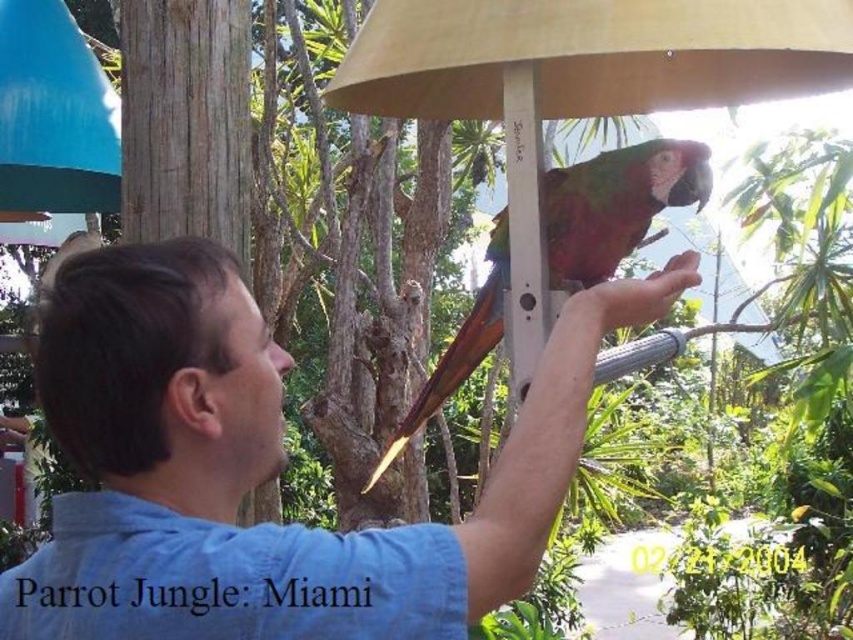
Question: Among these points, which one is nearest to the camera?

Choices:
 (A) (433, 611)
 (B) (643, 234)

Answer: (A)

Question: Which point appears closest to the camera in this image?

Choices:
 (A) (99, 624)
 (B) (492, 266)

Answer: (A)

Question: Is blue cotton shirt at center thinner than green matte parrot at center?

Choices:
 (A) yes
 (B) no

Answer: (B)

Question: Which point is farther from the camera taking this photo?

Choices:
 (A) (532, 465)
 (B) (583, 184)

Answer: (B)

Question: Is blue cotton shirt at center above green matte parrot at center?

Choices:
 (A) no
 (B) yes

Answer: (B)

Question: Does blue cotton shirt at center appear on the left side of green matte parrot at center?

Choices:
 (A) yes
 (B) no

Answer: (B)